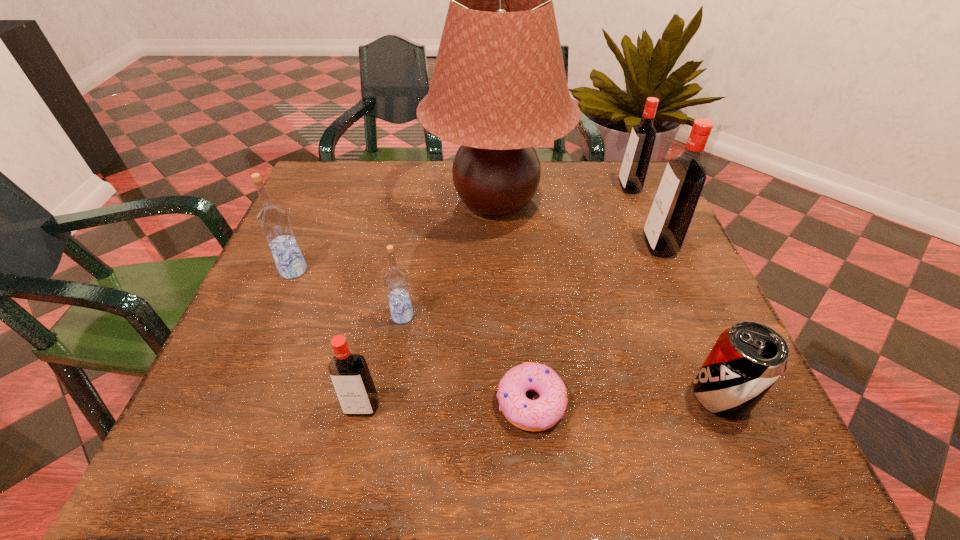
You are a GUI agent. You are given a task and a screenshot of the screen. Output one action in this format:
    pyautogui.click(x=<x>, y=<y>)
    Task: Click on the vacant space located 0.360m on the front and back of the tallest vodka
    
    Given the screenshot: What is the action you would take?
    pyautogui.click(x=489, y=246)

The image size is (960, 540). What are the coordinates of `vacant space located on the front and back of the farthest red vodka` in the screenshot? It's located at (470, 187).

The height and width of the screenshot is (540, 960). What are the coordinates of `vacant space located on the front and back of the farthest red vodka` in the screenshot? It's located at coord(597,187).

Locate an element on the screen. vacant space located 0.280m on the front and back of the farthest red vodka is located at coordinates (516, 187).

This screenshot has height=540, width=960. Find the location of `vacant space situated 0.320m on the back of the fifth nearest object`. vacant space situated 0.320m on the back of the fifth nearest object is located at coordinates (332, 181).

The image size is (960, 540). In order to click on free space located on the front and back of the nearest red vodka in this screenshot , I will do `click(352, 455)`.

The width and height of the screenshot is (960, 540). I want to click on free space located 0.240m on the back of the second nearest vodka, so click(x=416, y=232).

The height and width of the screenshot is (540, 960). What are the coordinates of `vacant region located 0.380m on the left of the seventh tallest object` in the screenshot? It's located at (468, 396).

Locate an element on the screen. The height and width of the screenshot is (540, 960). vacant region located on the left of the doughnut is located at coordinates (293, 402).

Locate an element on the screen. lampshade present at the far edge is located at coordinates (499, 88).